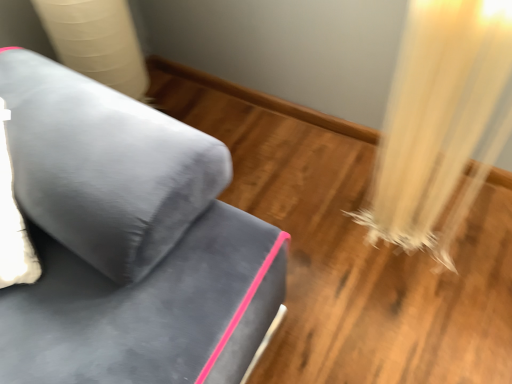
Where is `velvet gray couch at left`? This screenshot has width=512, height=384. velvet gray couch at left is located at coordinates (127, 241).

Describe the element at coordinates (127, 241) in the screenshot. Image resolution: width=512 pixels, height=384 pixels. I see `velvet gray couch at left` at that location.

Find the location of a particular element. The image size is (512, 384). velvet gray couch at left is located at coordinates (127, 241).